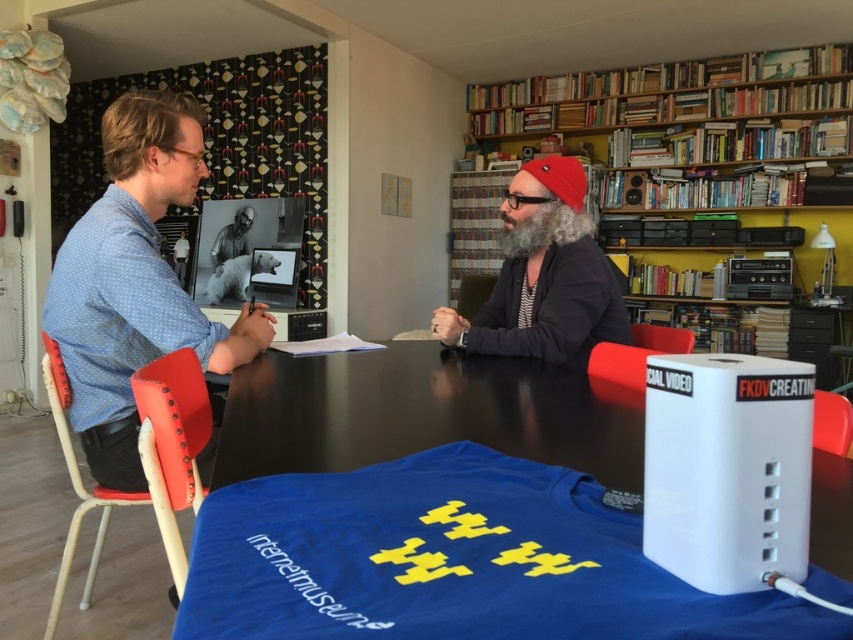
Question: Is red knit cap at center in front of graywoollybeard at center?

Choices:
 (A) yes
 (B) no

Answer: (A)

Question: Which is farther from the wooden bookshelf at upper right?

Choices:
 (A) blue dotted shirt at left
 (B) black glossy table at center

Answer: (B)

Question: Which point is farther from the camera taking this photo?

Choices:
 (A) (518, 234)
 (B) (579, 275)

Answer: (A)

Question: Can you confirm if black glossy table at center is positioned above red knit cap at center?

Choices:
 (A) yes
 (B) no

Answer: (B)

Question: Which object is the farthest from the graywoollybeard at center?

Choices:
 (A) black glossy table at center
 (B) blue dotted shirt at left
 (C) red knit cap at center
 (D) wooden bookshelf at upper right

Answer: (D)

Question: Is black glossy table at center above wooden bookshelf at upper right?

Choices:
 (A) yes
 (B) no

Answer: (B)